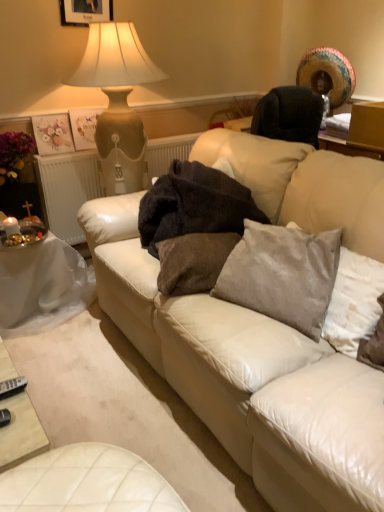
What do you see at coordinates (247, 377) in the screenshot? This screenshot has width=384, height=512. I see `white leather couch at center` at bounding box center [247, 377].

Describe the element at coordinates (194, 205) in the screenshot. I see `dark brown plush blanket at center` at that location.

Describe the element at coordinates (85, 12) in the screenshot. The width and height of the screenshot is (384, 512). I see `matte white picture frame at upper center` at that location.

Describe the element at coordinates (67, 190) in the screenshot. I see `white textured radiator at left` at that location.

Where is `white plastic table at lower left`? The image size is (384, 512). white plastic table at lower left is located at coordinates (42, 286).

Locate an element on the screen. This screenshot has width=384, height=512. brown velvet pillow at center, which ranks as the second pillow in right-to-left order is located at coordinates (193, 262).

Does matte white picture frame at upper center turn towards dark brown plush blanket at center?

No, matte white picture frame at upper center is not turned towards dark brown plush blanket at center.

Is matte white picture frame at upper center thinner than dark brown plush blanket at center?

Yes.

Which of these two, matte white picture frame at upper center or dark brown plush blanket at center, stands shorter?

With less height is dark brown plush blanket at center.

Consider the image. Can you tell me how much matte white picture frame at upper center and silver metallic remote at lower left differ in facing direction?

4.93 degrees separate the facing orientations of matte white picture frame at upper center and silver metallic remote at lower left.

Is matte white picture frame at upper center inside the boundaries of silver metallic remote at lower left, or outside?

matte white picture frame at upper center is outside silver metallic remote at lower left.

Which object is further away from the camera, matte white picture frame at upper center or silver metallic remote at lower left?

matte white picture frame at upper center is behind.

How many degrees apart are the facing directions of brown velvet pillow at center, which ranks as the second pillow in right-to-left order, and silver metallic remote at lower left?

The angular difference between brown velvet pillow at center, which ranks as the second pillow in right-to-left order, and silver metallic remote at lower left is 26 degrees.

Is brown velvet pillow at center, acting as the 1th pillow starting from the left, facing away from silver metallic remote at lower left?

No.

Is brown velvet pillow at center, which ranks as the second pillow in right-to-left order, bigger than silver metallic remote at lower left?

Yes, brown velvet pillow at center, which ranks as the second pillow in right-to-left order, is bigger than silver metallic remote at lower left.

Is brown velvet pillow at center, acting as the 1th pillow starting from the left, in contact with silver metallic remote at lower left?

No, brown velvet pillow at center, acting as the 1th pillow starting from the left, is not touching silver metallic remote at lower left.

From a real-world perspective, which is physically below, white textured radiator at left or dark brown plush blanket at center?

In real-world perspective, white textured radiator at left is lower.

What are the coordinates of `radiator that is behind the dark brown plush blanket at center` in the screenshot? It's located at (67, 190).

Is white textured radiator at left taller or shorter than dark brown plush blanket at center?

Clearly, white textured radiator at left is taller compared to dark brown plush blanket at center.

Would you say white textured radiator at left is a long distance from dark brown plush blanket at center?

white textured radiator at left is actually quite close to dark brown plush blanket at center.

From the image's perspective, is dark brown plush blanket at center located above or below white leather couch at center?

dark brown plush blanket at center is above white leather couch at center.

Locate an element on the screen. The height and width of the screenshot is (512, 384). blanket above the white leather couch at center (from a real-world perspective) is located at coordinates (194, 205).

Looking at their sizes, would you say dark brown plush blanket at center is wider or thinner than white leather couch at center?

Considering their sizes, dark brown plush blanket at center looks slimmer than white leather couch at center.

In terms of size, does dark brown plush blanket at center appear bigger or smaller than white leather couch at center?

Considering their sizes, dark brown plush blanket at center takes up less space than white leather couch at center.

Is brown velvet pillow at center, acting as the 1th pillow starting from the left, smaller than white plastic table at lower left?

Yes.

From the image's perspective, is brown velvet pillow at center, acting as the 1th pillow starting from the left, above or below white plastic table at lower left?

From the image's perspective, brown velvet pillow at center, acting as the 1th pillow starting from the left, appears above white plastic table at lower left.

Considering the sizes of brown velvet pillow at center, acting as the 1th pillow starting from the left, and white plastic table at lower left in the image, is brown velvet pillow at center, acting as the 1th pillow starting from the left, taller or shorter than white plastic table at lower left?

In the image, brown velvet pillow at center, acting as the 1th pillow starting from the left, appears to be shorter than white plastic table at lower left.

Can you tell me how much dark brown plush blanket at center and silver metallic remote at lower left differ in facing direction?

There is a 38.7-degree angle between the facing directions of dark brown plush blanket at center and silver metallic remote at lower left.

Can you confirm if dark brown plush blanket at center is shorter than silver metallic remote at lower left?

No.

Can you confirm if dark brown plush blanket at center is wider than silver metallic remote at lower left?

Yes, dark brown plush blanket at center is wider than silver metallic remote at lower left.

Where is `blanket below the matte white picture frame at upper center (from the image's perspective)`? This screenshot has height=512, width=384. blanket below the matte white picture frame at upper center (from the image's perspective) is located at coordinates (194, 205).

Locate an element on the screen. picture frame behind the silver metallic remote at lower left is located at coordinates (85, 12).

Which object lies nearer to the anchor point white leather couch at center, brown velvet pillow at center, acting as the 1th pillow starting from the left, or white plastic table at lower left?

The object closer to white leather couch at center is brown velvet pillow at center, acting as the 1th pillow starting from the left.

Estimate the real-world distances between objects in this image. Which object is closer to white plastic table at lower left, brown velvet pillow at center, acting as the 1th pillow starting from the left, or dark brown plush blanket at center?

dark brown plush blanket at center is positioned closer to the anchor white plastic table at lower left.

When comparing their distances from matte white picture frame at upper center, does satin gray pillow at center, which ranks as the first pillow in right-to-left order, or white leather couch at center seem closer?

white leather couch at center is closer to matte white picture frame at upper center.

When comparing their distances from white leather couch at center, does matte white picture frame at upper center or white textured radiator at left seem closer?

Among the two, white textured radiator at left is located nearer to white leather couch at center.

Looking at the image, which one is located closer to satin gray pillow at center, the second pillow viewed from the left, silver metallic remote at lower left or matte white picture frame at upper center?

silver metallic remote at lower left is positioned closer to the anchor satin gray pillow at center, the second pillow viewed from the left.

Considering their positions, is white textured radiator at left positioned closer to satin gray pillow at center, the second pillow viewed from the left, than white leather couch at center?

white leather couch at center lies closer to satin gray pillow at center, the second pillow viewed from the left, than the other object.

When comparing their distances from white plastic table at lower left, does silver metallic remote at lower left or matte white picture frame at upper center seem closer?

silver metallic remote at lower left is positioned closer to the anchor white plastic table at lower left.

Which object lies nearer to the anchor point matte white picture frame at upper center, white leather couch at center or white plastic table at lower left?

white plastic table at lower left.

The width and height of the screenshot is (384, 512). What are the coordinates of `blanket located between white plastic table at lower left and satin gray pillow at center, the second pillow viewed from the left, in the left-right direction` in the screenshot? It's located at (194, 205).

This screenshot has width=384, height=512. I want to click on radiator between matte white picture frame at upper center and white plastic table at lower left vertically, so pyautogui.click(x=67, y=190).

You are a GUI agent. You are given a task and a screenshot of the screen. Output one action in this format:
    pyautogui.click(x=<x>, y=<y>)
    Task: Click on the blanket positioned between satin gray pillow at center, which ranks as the first pillow in right-to-left order, and white textured radiator at left from near to far
    Image resolution: width=384 pixels, height=512 pixels.
    Given the screenshot: What is the action you would take?
    pyautogui.click(x=194, y=205)

Locate an element on the screen. blanket that lies between matte white picture frame at upper center and silver metallic remote at lower left from top to bottom is located at coordinates (194, 205).